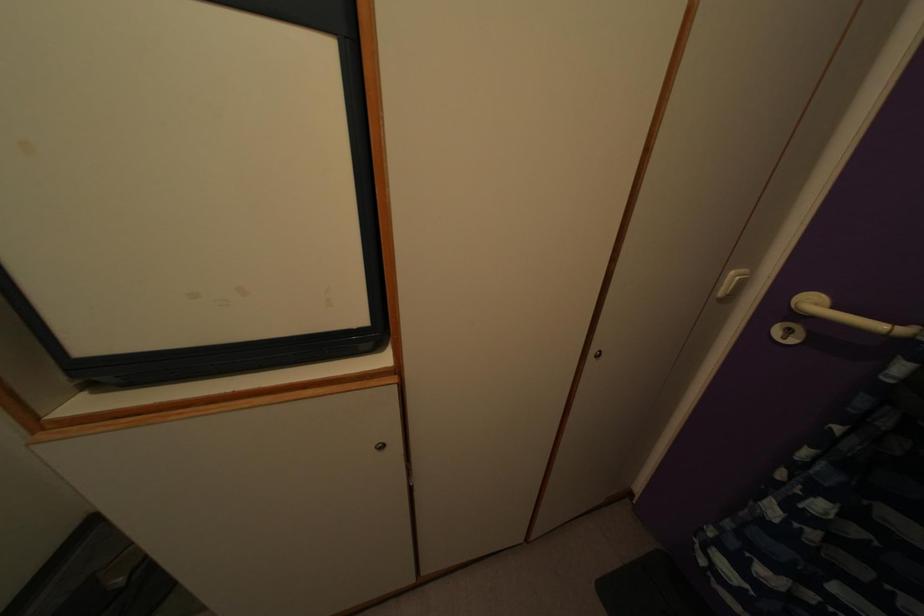
Find where to pull the white cabinet handle. Please return your answer as a coordinate pair (x, y).

(732, 283)